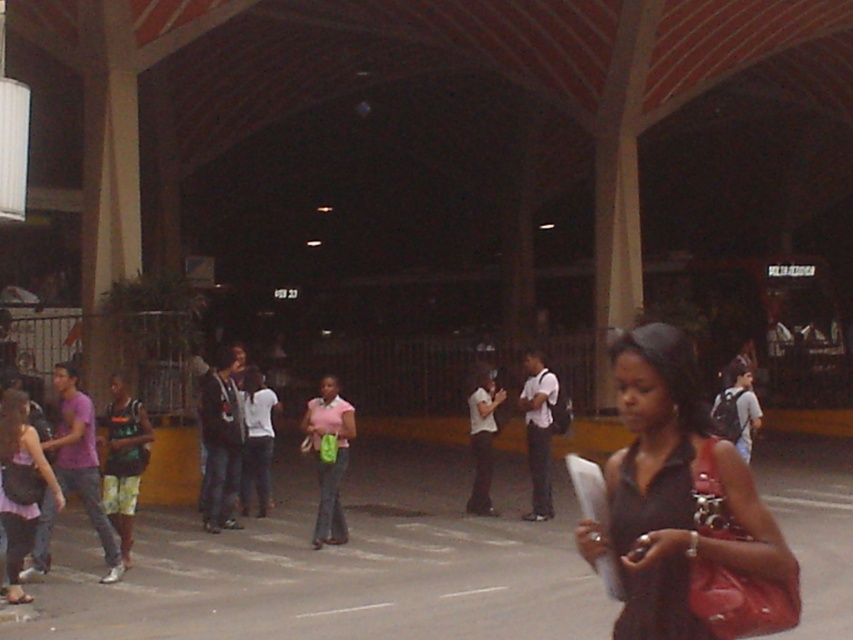
Who is shorter, matte black dress at center or matte pink skirt at lower left?

matte black dress at center is shorter.

What do you see at coordinates (683, 509) in the screenshot? I see `matte black dress at center` at bounding box center [683, 509].

Is point (659, 376) positioned in front of point (16, 586)?

That is True.

Identify the location of matte black dress at center. (683, 509).